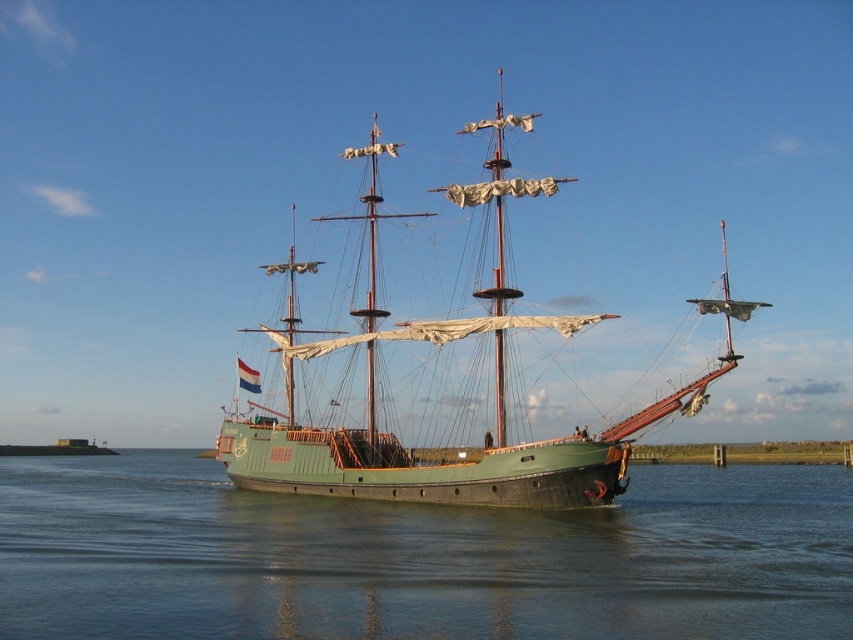
Question: In this image, where is green matte water at center located relative to green matte sailboat at center?

Choices:
 (A) above
 (B) below

Answer: (B)

Question: Which of the following is the farthest from the observer?

Choices:
 (A) green matte water at center
 (B) green matte sailboat at center

Answer: (B)

Question: Which of the following is the farthest from the observer?

Choices:
 (A) (109, 484)
 (B) (479, 474)

Answer: (A)

Question: Does green matte water at center have a greater width compared to green matte sailboat at center?

Choices:
 (A) yes
 (B) no

Answer: (A)

Question: Is green matte water at center thinner than green matte sailboat at center?

Choices:
 (A) yes
 (B) no

Answer: (B)